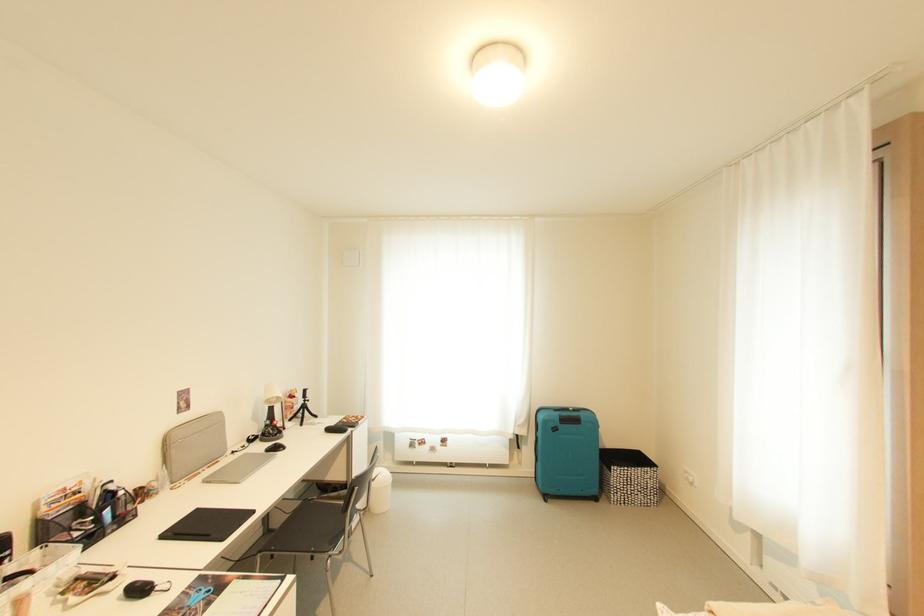
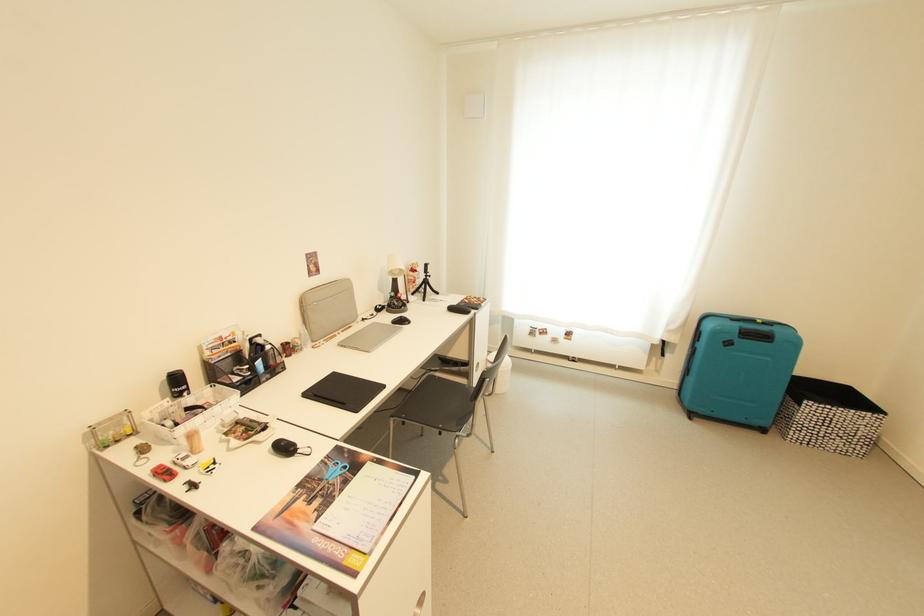
The images are taken continuously from a first-person perspective. In which direction is your viewpoint rotating?

The camera's rotation is toward left-down.